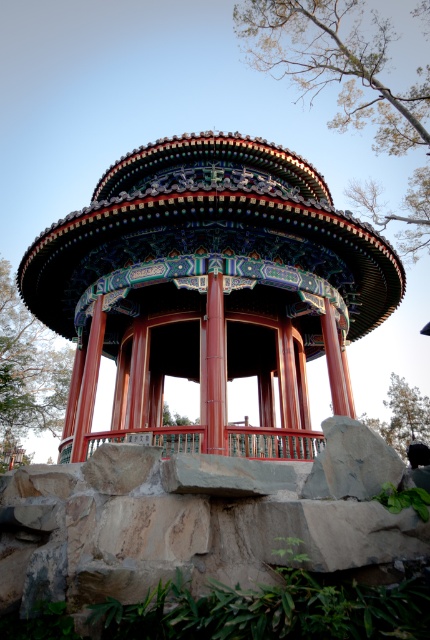
Between green leafy tree at upper center and green leafy tree at lower left, which one is positioned lower?

green leafy tree at lower left

What do you see at coordinates (337, 64) in the screenshot? I see `green leafy tree at upper center` at bounding box center [337, 64].

I want to click on green leafy tree at upper center, so click(x=337, y=64).

Is point (380, 68) positioned behind point (417, 406)?

No, it is not.

Consider the image. Who is higher up, green leafy tree at upper center or green leafy tree at lower right?

green leafy tree at upper center is higher up.

Is point (412, 177) less distant than point (405, 444)?

No.

The height and width of the screenshot is (640, 430). What are the coordinates of `green leafy tree at upper center` in the screenshot? It's located at (337, 64).

Does polished wood gazebo at center have a larger size compared to green leafy tree at upper center?

No.

Is polished wood gazebo at center further to the viewer compared to green leafy tree at upper center?

No, it is in front of green leafy tree at upper center.

Which is in front, point (30, 244) or point (283, 52)?

Point (30, 244) is in front.

You are a GUI agent. You are given a task and a screenshot of the screen. Output one action in this format:
    pyautogui.click(x=<x>, y=<y>)
    Task: Click on the polished wood gazebo at center
    This screenshot has width=430, height=640.
    Given the screenshot: What is the action you would take?
    pyautogui.click(x=208, y=282)